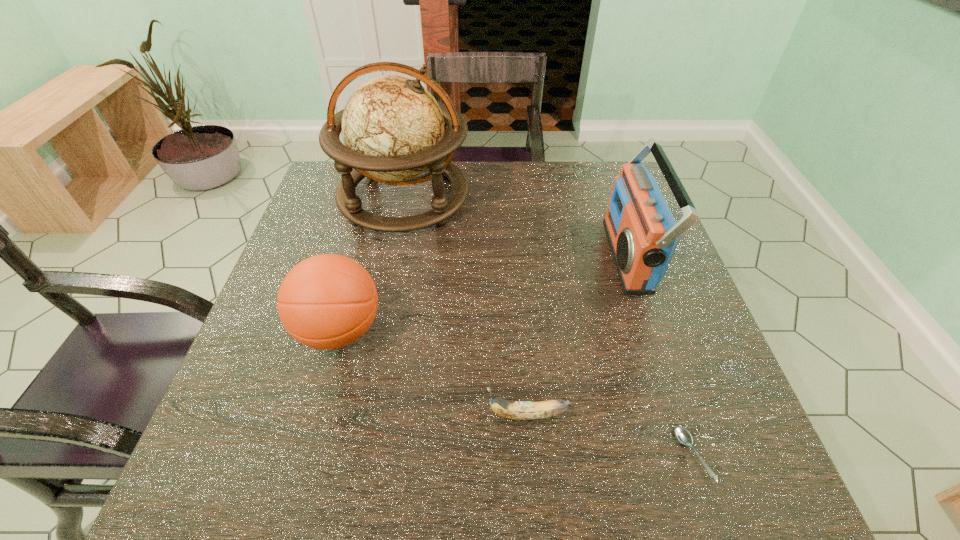
The image size is (960, 540). I want to click on free space located 0.120m on the front-facing side of the radio receiver, so click(x=560, y=255).

Find the location of `free space located 0.360m on the back of the third tallest object`. free space located 0.360m on the back of the third tallest object is located at coordinates point(375,201).

Image resolution: width=960 pixels, height=540 pixels. Identify the location of vacant space situated at the stem of the banana. (286, 415).

The height and width of the screenshot is (540, 960). Identify the location of vacant space located 0.210m at the stem of the banana. (370, 415).

You are a GUI agent. You are given a task and a screenshot of the screen. Output one action in this format:
    pyautogui.click(x=<x>, y=<y>)
    Task: Click on the free point located 0.270m at the stem of the banana
    
    Given the screenshot: What is the action you would take?
    pyautogui.click(x=336, y=415)

Where is `free location located 0.060m on the right of the shortest object`? The height and width of the screenshot is (540, 960). free location located 0.060m on the right of the shortest object is located at coordinates (741, 455).

Identify the location of object positioned at the far edge. This screenshot has width=960, height=540. (394, 130).

At what (x,y) coordinates should I click in order to perform the action: click on object that is positioned at the near edge. Please return your answer as a coordinate pair (x, y). Image resolution: width=960 pixels, height=540 pixels. Looking at the image, I should click on (683, 436).

This screenshot has width=960, height=540. Find the location of `globe present at the left edge`. globe present at the left edge is located at coordinates (394, 130).

Find the location of a particular element. The width and height of the screenshot is (960, 540). basketball that is at the left edge is located at coordinates (328, 301).